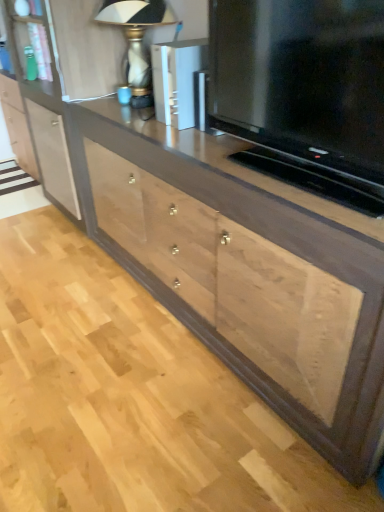
Question: Is matte black television at center at the back of matte glass table lamp at upper center?

Choices:
 (A) yes
 (B) no

Answer: (B)

Question: Does matte glass table lamp at upper center have a smaller size compared to matte black television at center?

Choices:
 (A) no
 (B) yes

Answer: (B)

Question: Could matte black television at center be considered to be inside matte glass table lamp at upper center?

Choices:
 (A) no
 (B) yes

Answer: (A)

Question: Would you say matte glass table lamp at upper center is outside matte black television at center?

Choices:
 (A) yes
 (B) no

Answer: (A)

Question: Are matte glass table lamp at upper center and matte black television at center far apart?

Choices:
 (A) no
 (B) yes

Answer: (A)

Question: From the image's perspective, is metallic silver speaker at upper center positioned above or below matte black television at center?

Choices:
 (A) below
 (B) above

Answer: (B)

Question: Is metallic silver speaker at upper center inside or outside of matte black television at center?

Choices:
 (A) inside
 (B) outside

Answer: (B)

Question: Considering the positions of metallic silver speaker at upper center and matte black television at center in the image, is metallic silver speaker at upper center taller or shorter than matte black television at center?

Choices:
 (A) tall
 (B) short

Answer: (B)

Question: Considering the positions of metallic silver speaker at upper center and matte black television at center in the image, is metallic silver speaker at upper center wider or thinner than matte black television at center?

Choices:
 (A) thin
 (B) wide

Answer: (B)

Question: Is metallic silver speaker at upper center in front of or behind matte glass table lamp at upper center in the image?

Choices:
 (A) front
 (B) behind

Answer: (A)

Question: From a real-world perspective, is metallic silver speaker at upper center above or below matte glass table lamp at upper center?

Choices:
 (A) below
 (B) above

Answer: (A)

Question: Does point (200, 60) appear closer or farther from the camera than point (142, 68)?

Choices:
 (A) closer
 (B) farther

Answer: (A)

Question: In terms of height, does metallic silver speaker at upper center look taller or shorter compared to matte glass table lamp at upper center?

Choices:
 (A) short
 (B) tall

Answer: (A)

Question: Which is correct: natural wood drawer at center is inside metallic silver speaker at upper center, or outside of it?

Choices:
 (A) outside
 (B) inside

Answer: (A)

Question: Considering the positions of point (307, 320) and point (170, 92), is point (307, 320) closer or farther from the camera than point (170, 92)?

Choices:
 (A) closer
 (B) farther

Answer: (A)